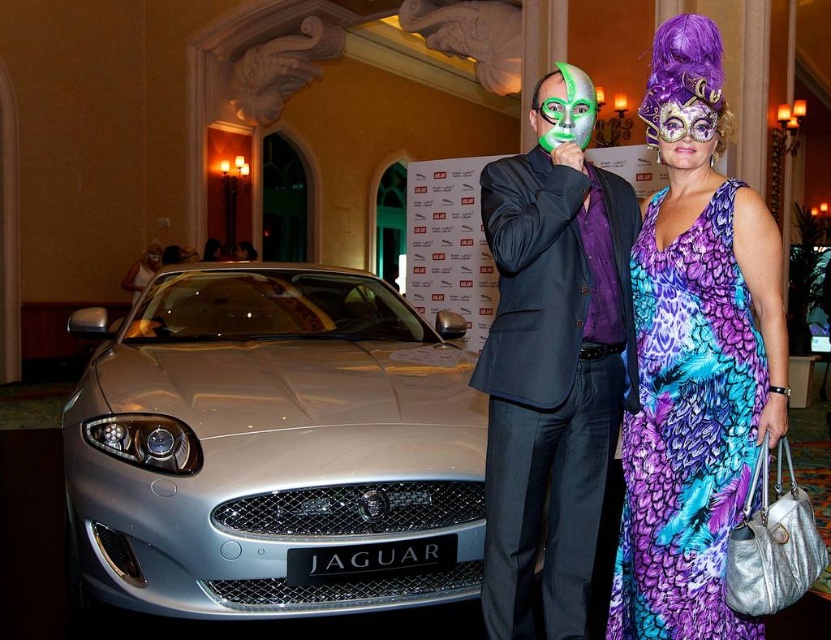
In the scene shown: Does silver metallic jaguar at center have a larger size compared to metallic silver car at left?

Yes.

Does point (313, 532) lie in front of point (706, 432)?

No.

Identify the location of silver metallic jaguar at center. This screenshot has height=640, width=831. (274, 449).

Which is in front, point (342, 461) or point (662, 138)?

Point (662, 138) is in front.

Which is above, silver metallic jaguar at center or purple shiny mask at upper right?

purple shiny mask at upper right is above.

Between point (421, 385) and point (699, 104), which one is positioned in front?

Point (699, 104) is more forward.

At what (x,y) coordinates should I click in order to perform the action: click on silver metallic jaguar at center. Please return your answer as a coordinate pair (x, y). This screenshot has height=640, width=831. Looking at the image, I should click on (274, 449).

Is silver metallic jaguar at center to the right of purple printed dress at right from the viewer's perspective?

No, silver metallic jaguar at center is not to the right of purple printed dress at right.

Which is more to the left, silver metallic jaguar at center or purple printed dress at right?

silver metallic jaguar at center is more to the left.

This screenshot has height=640, width=831. What are the coordinates of `silver metallic jaguar at center` in the screenshot? It's located at (274, 449).

Where is `silver metallic jaguar at center`? This screenshot has height=640, width=831. silver metallic jaguar at center is located at coordinates (274, 449).